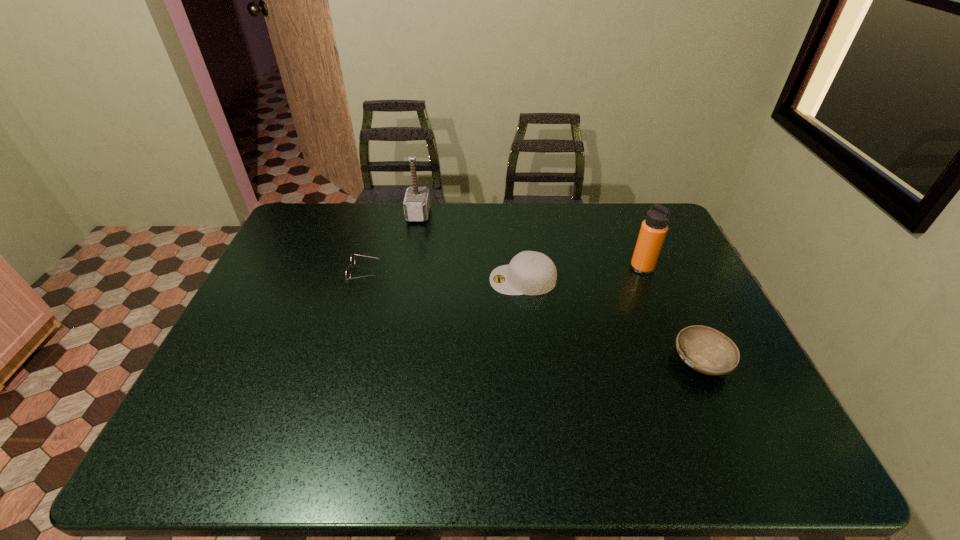
At what (x,y) coordinates should I click in order to perform the action: click on the fourth object from right to left. Please return your answer as a coordinate pair (x, y). Looking at the image, I should click on (416, 203).

This screenshot has width=960, height=540. In order to click on hammer in this screenshot , I will do `click(416, 203)`.

This screenshot has width=960, height=540. Identify the location of thermos bottle. (x=653, y=231).

The height and width of the screenshot is (540, 960). I want to click on the third object from left to right, so click(x=531, y=273).

Where is `the third shortest object`? The image size is (960, 540). the third shortest object is located at coordinates (531, 273).

Where is `the second shortest object`? the second shortest object is located at coordinates pos(706,350).

Find the location of a particular element. Image resolution: width=960 pixels, height=540 pixels. the nearest object is located at coordinates pyautogui.click(x=706, y=350).

You are a GUI agent. You are given a task and a screenshot of the screen. Output one action in this format:
    pyautogui.click(x=<x>, y=<y>)
    Task: Click on the leftmost object
    
    Given the screenshot: What is the action you would take?
    pyautogui.click(x=352, y=264)

The image size is (960, 540). Identify the location of spectacles. (352, 264).

I want to click on vacant space situated for striking with the head of the fourth object from right to left, so click(x=473, y=214).